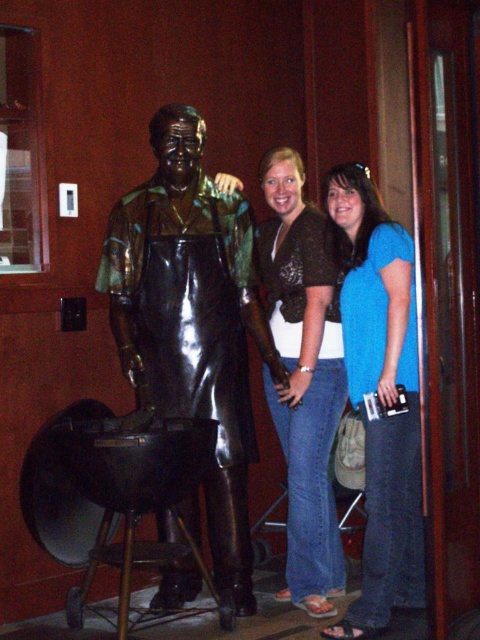
Which of these two, bronze statue at center or brown textured shirt at center, stands shorter?

With less height is brown textured shirt at center.

Can you confirm if bronze statue at center is bigger than brown textured shirt at center?

Yes, bronze statue at center is bigger than brown textured shirt at center.

The image size is (480, 640). In order to click on bronze statue at center in this screenshot , I will do `click(192, 321)`.

The width and height of the screenshot is (480, 640). Identify the location of bronze statue at center. (192, 321).

Is blue cotton shirt at center positioned in front of brown textured shirt at center?

Yes, it is.

Can you confirm if blue cotton shirt at center is bigger than brown textured shirt at center?

Actually, blue cotton shirt at center might be smaller than brown textured shirt at center.

At what (x,y) coordinates should I click in order to perform the action: click on blue cotton shirt at center. Please return your answer as a coordinate pair (x, y). Image resolution: width=480 pixels, height=640 pixels. Looking at the image, I should click on (381, 396).

Find the location of a particular element. blue cotton shirt at center is located at coordinates [381, 396].

Is bronze statue at center taller than blue cotton shirt at center?

Answer: Yes, bronze statue at center is taller than blue cotton shirt at center.

Who is more forward, (241, 547) or (344, 304)?

Point (344, 304)

You are a GUI agent. You are given a task and a screenshot of the screen. Output one action in this format:
    pyautogui.click(x=<x>, y=<y>)
    Task: Click on the bronze statue at center
    This screenshot has width=480, height=640.
    Given the screenshot: What is the action you would take?
    pyautogui.click(x=192, y=321)